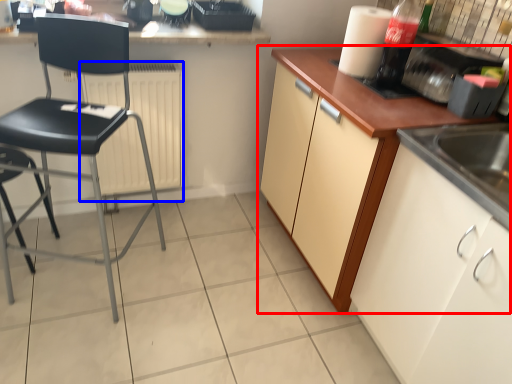
Question: Which of the following is the farthest to the observer, cabinetry (highlighted by a red box) or radiator (highlighted by a blue box)?

Choices:
 (A) cabinetry
 (B) radiator

Answer: (B)